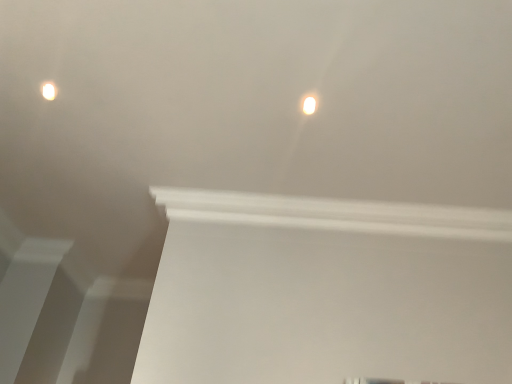
The width and height of the screenshot is (512, 384). Describe the element at coordinates (309, 105) in the screenshot. I see `white glossy light fixture at upper center, the first lamp viewed from the right` at that location.

At what (x,y) coordinates should I click in order to perform the action: click on white glossy light fixture at upper center, marked as the second lamp in a left-to-right arrangement. Please return your answer as a coordinate pair (x, y). The width and height of the screenshot is (512, 384). Looking at the image, I should click on (309, 105).

What is the approximate width of white glossy light fixture at upper center, the 1th lamp in the front-to-back sequence?

The width of white glossy light fixture at upper center, the 1th lamp in the front-to-back sequence, is 5.83 centimeters.

What do you see at coordinates (48, 91) in the screenshot? The image size is (512, 384). I see `matte white light fixture at upper left, the second lamp positioned from the front` at bounding box center [48, 91].

At what (x,y) coordinates should I click in order to perform the action: click on matte white light fixture at upper left, which ranks as the first lamp in back-to-front order. Please return your answer as a coordinate pair (x, y). Looking at the image, I should click on (48, 91).

In order to click on white glossy light fixture at upper center, the first lamp viewed from the right in this screenshot , I will do `click(309, 105)`.

Is matte white light fixture at upper left, the second lamp positioned from the front, to the right of white glossy light fixture at upper center, marked as the second lamp in a left-to-right arrangement, from the viewer's perspective?

In fact, matte white light fixture at upper left, the second lamp positioned from the front, is to the left of white glossy light fixture at upper center, marked as the second lamp in a left-to-right arrangement.

Is the position of matte white light fixture at upper left, the 2th lamp ordered from the bottom, less distant than that of white glossy light fixture at upper center, arranged as the second lamp when viewed from the top?

No, matte white light fixture at upper left, the 2th lamp ordered from the bottom, is further to the viewer.

Which is closer to the camera, (46, 91) or (306, 101)?

Clearly, point (46, 91) is more distant from the camera than point (306, 101).

From the image's perspective, who appears lower, matte white light fixture at upper left, acting as the 1th lamp starting from the top, or white glossy light fixture at upper center, arranged as the second lamp when viewed from the top?

From the image's view, white glossy light fixture at upper center, arranged as the second lamp when viewed from the top, is below.

From a real-world perspective, is matte white light fixture at upper left, the second lamp viewed from the right, physically located above or below white glossy light fixture at upper center, arranged as the second lamp when viewed from the top?

Clearly, from a real-world perspective, matte white light fixture at upper left, the second lamp viewed from the right, is above white glossy light fixture at upper center, arranged as the second lamp when viewed from the top.

Between matte white light fixture at upper left, which appears as the first lamp when viewed from the left, and white glossy light fixture at upper center, arranged as the second lamp when viewed from the top, which one has smaller width?

Thinner between the two is matte white light fixture at upper left, which appears as the first lamp when viewed from the left.

Is matte white light fixture at upper left, which ranks as the first lamp in back-to-front order, shorter than white glossy light fixture at upper center, the first lamp viewed from the right?

In fact, matte white light fixture at upper left, which ranks as the first lamp in back-to-front order, may be taller than white glossy light fixture at upper center, the first lamp viewed from the right.

Which of these two, matte white light fixture at upper left, the second lamp viewed from the right, or white glossy light fixture at upper center, the 1th lamp in the front-to-back sequence, is bigger?

Bigger between the two is matte white light fixture at upper left, the second lamp viewed from the right.

Could white glossy light fixture at upper center, marked as the second lamp in a left-to-right arrangement, be considered to be inside matte white light fixture at upper left, which ranks as the first lamp in back-to-front order?

No, white glossy light fixture at upper center, marked as the second lamp in a left-to-right arrangement, is not surrounded by matte white light fixture at upper left, which ranks as the first lamp in back-to-front order.

Are matte white light fixture at upper left, the second lamp viewed from the right, and white glossy light fixture at upper center, positioned as the first lamp in bottom-to-top order, beside each other?

No.

Based on the photo, is matte white light fixture at upper left, which appears as the first lamp when viewed from the left, aimed at white glossy light fixture at upper center, arranged as the second lamp when viewed from the top?

No, matte white light fixture at upper left, which appears as the first lamp when viewed from the left, is not facing towards white glossy light fixture at upper center, arranged as the second lamp when viewed from the top.

In order to click on lamp that is on the left side of white glossy light fixture at upper center, the 1th lamp in the front-to-back sequence in this screenshot , I will do `click(48, 91)`.

Considering the relative positions of white glossy light fixture at upper center, the 1th lamp in the front-to-back sequence, and matte white light fixture at upper left, acting as the 1th lamp starting from the top, in the image provided, is white glossy light fixture at upper center, the 1th lamp in the front-to-back sequence, to the right of matte white light fixture at upper left, acting as the 1th lamp starting from the top, from the viewer's perspective?

Yes, white glossy light fixture at upper center, the 1th lamp in the front-to-back sequence, is to the right of matte white light fixture at upper left, acting as the 1th lamp starting from the top.

Is white glossy light fixture at upper center, the first lamp viewed from the right, positioned behind matte white light fixture at upper left, which ranks as the first lamp in back-to-front order?

No, white glossy light fixture at upper center, the first lamp viewed from the right, is closer to the viewer.

Is point (307, 103) positioned before point (47, 98)?

Yes, point (307, 103) is closer to viewer.

From the image's perspective, between white glossy light fixture at upper center, positioned as the first lamp in bottom-to-top order, and matte white light fixture at upper left, the second lamp positioned from the front, which one is located above?

From the image's view, matte white light fixture at upper left, the second lamp positioned from the front, is above.

From a real-world perspective, is white glossy light fixture at upper center, positioned as the first lamp in bottom-to-top order, on matte white light fixture at upper left, which appears as the first lamp when viewed from the left?

No, from a real-world perspective, white glossy light fixture at upper center, positioned as the first lamp in bottom-to-top order, is not on top of matte white light fixture at upper left, which appears as the first lamp when viewed from the left.

Considering the sizes of objects white glossy light fixture at upper center, arranged as the second lamp when viewed from the top, and matte white light fixture at upper left, acting as the 1th lamp starting from the top, in the image provided, who is thinner, white glossy light fixture at upper center, arranged as the second lamp when viewed from the top, or matte white light fixture at upper left, acting as the 1th lamp starting from the top,?

With smaller width is matte white light fixture at upper left, acting as the 1th lamp starting from the top.

Between white glossy light fixture at upper center, which is the second lamp in back-to-front order, and matte white light fixture at upper left, which appears as the first lamp when viewed from the left, which one has more height?

matte white light fixture at upper left, which appears as the first lamp when viewed from the left.

Does white glossy light fixture at upper center, which is the second lamp in back-to-front order, have a larger size compared to matte white light fixture at upper left, the 2th lamp ordered from the bottom?

Actually, white glossy light fixture at upper center, which is the second lamp in back-to-front order, might be smaller than matte white light fixture at upper left, the 2th lamp ordered from the bottom.

Would you say white glossy light fixture at upper center, which is the second lamp in back-to-front order, contains matte white light fixture at upper left, the 2th lamp ordered from the bottom?

No, white glossy light fixture at upper center, which is the second lamp in back-to-front order, does not contain matte white light fixture at upper left, the 2th lamp ordered from the bottom.

Is white glossy light fixture at upper center, marked as the second lamp in a left-to-right arrangement, far away from matte white light fixture at upper left, the second lamp viewed from the right?

Yes, white glossy light fixture at upper center, marked as the second lamp in a left-to-right arrangement, and matte white light fixture at upper left, the second lamp viewed from the right, are located far from each other.

From the picture: Is white glossy light fixture at upper center, the first lamp viewed from the right, oriented away from matte white light fixture at upper left, acting as the 1th lamp starting from the top?

white glossy light fixture at upper center, the first lamp viewed from the right, is not turned away from matte white light fixture at upper left, acting as the 1th lamp starting from the top.

Could you measure the distance between white glossy light fixture at upper center, arranged as the second lamp when viewed from the top, and matte white light fixture at upper left, the 2th lamp ordered from the bottom?

white glossy light fixture at upper center, arranged as the second lamp when viewed from the top, and matte white light fixture at upper left, the 2th lamp ordered from the bottom, are 1.03 meters apart.

This screenshot has width=512, height=384. Find the location of `lamp in front of the matte white light fixture at upper left, acting as the 1th lamp starting from the top`. lamp in front of the matte white light fixture at upper left, acting as the 1th lamp starting from the top is located at coordinates (309, 105).

You are a GUI agent. You are given a task and a screenshot of the screen. Output one action in this format:
    pyautogui.click(x=<x>, y=<y>)
    Task: Click on the lamp to the left of white glossy light fixture at upper center, which is the second lamp in back-to-front order
    The height and width of the screenshot is (384, 512).
    Given the screenshot: What is the action you would take?
    pyautogui.click(x=48, y=91)

Where is `lamp behind the white glossy light fixture at upper center, the 1th lamp in the front-to-back sequence`? The height and width of the screenshot is (384, 512). lamp behind the white glossy light fixture at upper center, the 1th lamp in the front-to-back sequence is located at coordinates (48, 91).